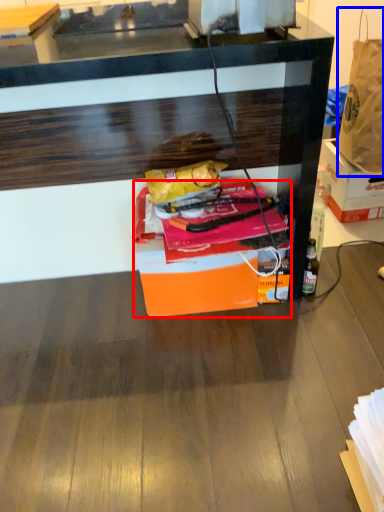
Question: Which of the following is the closest to the observer, box (highlighted by a red box) or handbag (highlighted by a blue box)?

Choices:
 (A) box
 (B) handbag

Answer: (A)